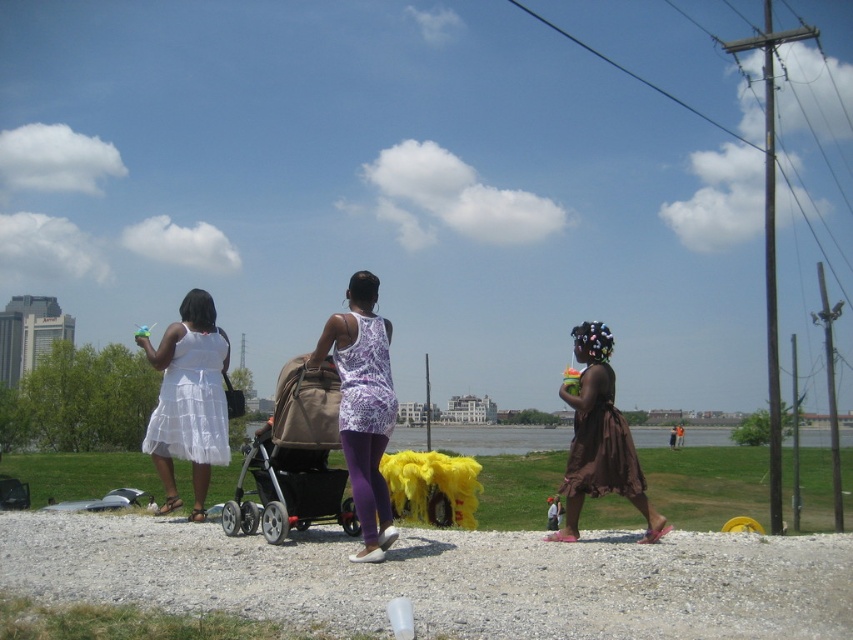
Question: Which object appears farthest from the camera in this image?

Choices:
 (A) purple printed dress at center
 (B) purple printed tank top at center

Answer: (A)

Question: Among these objects, which one is farthest from the camera?

Choices:
 (A) brown fabric stroller at center
 (B) purple printed dress at center
 (C) brown satin dress at lower right

Answer: (C)

Question: Which is nearer to the brown satin dress at right?

Choices:
 (A) purple printed dress at center
 (B) brown satin dress at lower right

Answer: (B)

Question: Is brown fabric stroller at center to the left of brown satin dress at right from the viewer's perspective?

Choices:
 (A) no
 (B) yes

Answer: (B)

Question: Can you confirm if brown fabric stroller at center is positioned above white satin dress at left?

Choices:
 (A) yes
 (B) no

Answer: (B)

Question: Is white satin dress at left in front of purple printed dress at center?

Choices:
 (A) yes
 (B) no

Answer: (B)